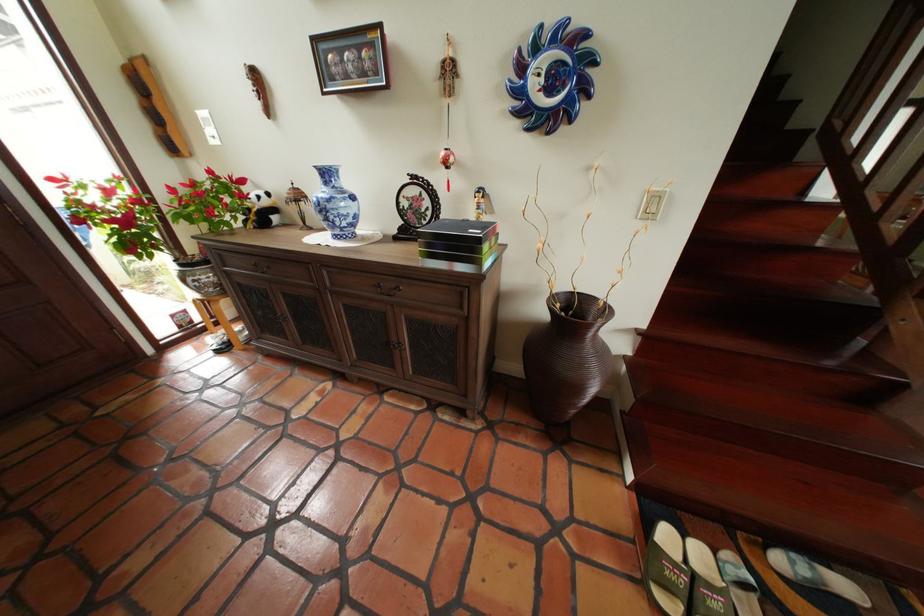
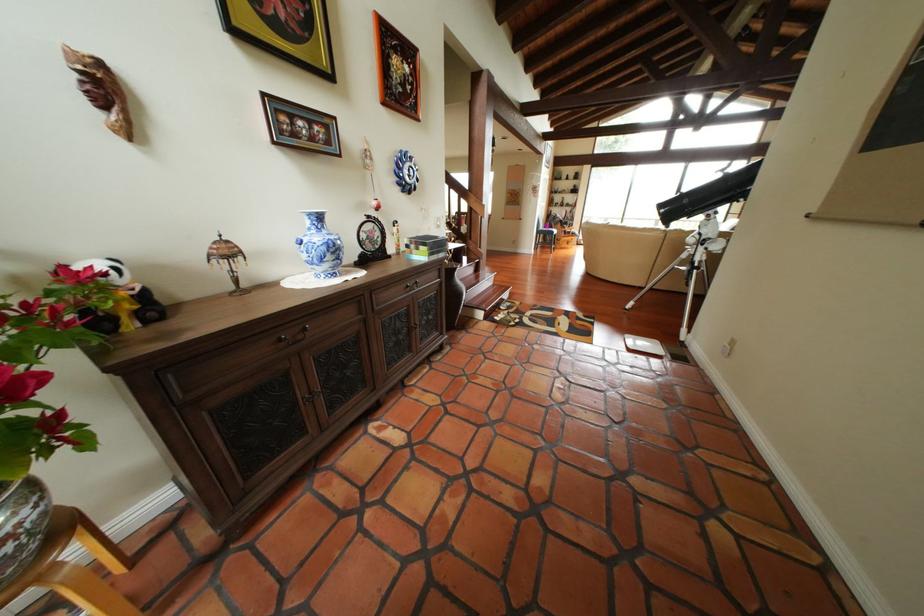
The point at (x=207, y=283) is marked in the first image. Where is the corresponding point in the second image?

(11, 546)